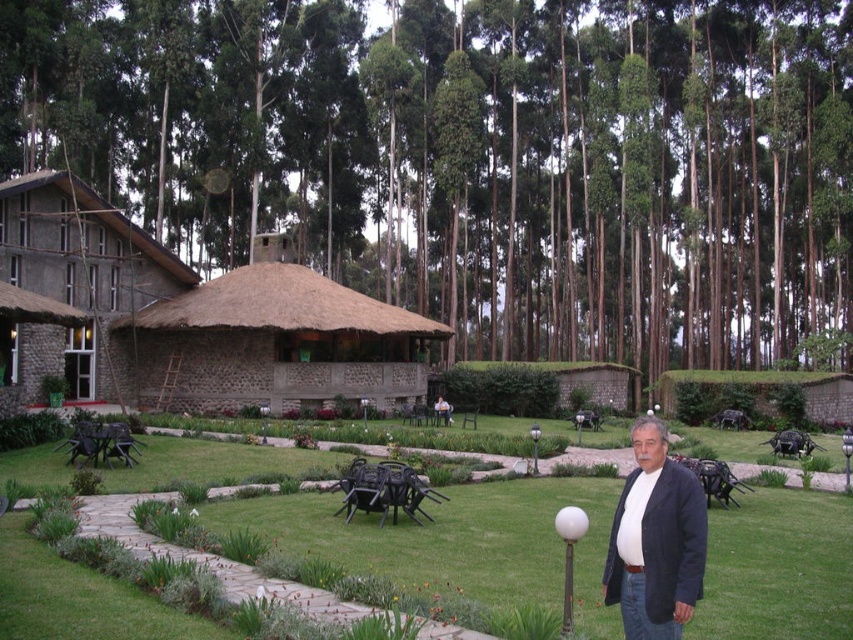
You are standing in the garden and want to take a photo of the brown thatch roof at upper center and the brown thatch hut at center. Which object should you position to the right side of your camera frame to include both in the shot?

You should position the brown thatch hut at center to the right side of your camera frame because the brown thath roof at upper center is to the right of the brown thath hut at center.

You are a visitor in the garden and want to take a photo of the brown thatch roof at upper center without any obstructions. Is the white matte jacket at lower right blocking your view of it?

The white matte jacket at lower right is behind the brown thatch roof at upper center, so it will not block your view of the brown thatch roof at upper center.

You are standing at the point labeled as point (453, 540) in the image. What is the immediate surface you are standing on?

The immediate surface you are standing on is green grass at center, as the point (453, 540) corresponds to this location.